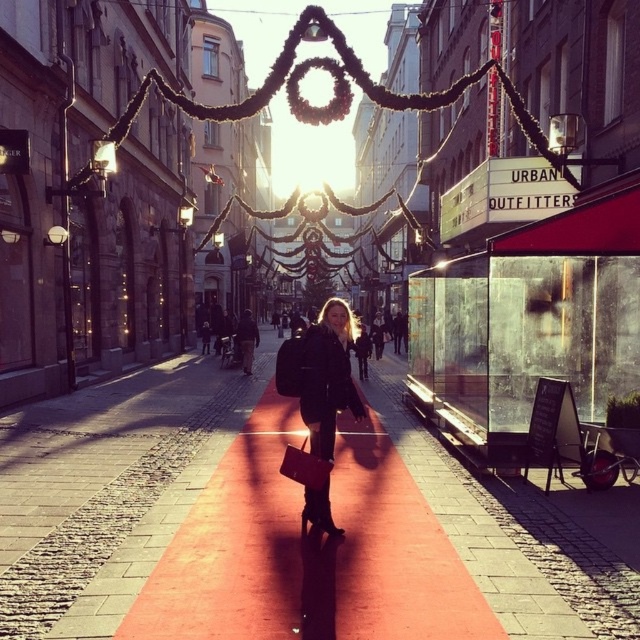
Question: Is smooth red carpet at center thinner than leather jacket at center?

Choices:
 (A) no
 (B) yes

Answer: (B)

Question: Which of the following is the farthest from the observer?

Choices:
 (A) smooth red carpet at center
 (B) matte black coat at center
 (C) leather jacket at center

Answer: (C)

Question: Which point appears farthest from the camera in this image?

Choices:
 (A) (248, 362)
 (B) (324, 394)

Answer: (A)

Question: Can you confirm if smooth red carpet at center is positioned below matte black coat at center?

Choices:
 (A) no
 (B) yes

Answer: (B)

Question: Does smooth red carpet at center appear over matte black coat at center?

Choices:
 (A) yes
 (B) no

Answer: (B)

Question: Which of the following is the closest to the observer?

Choices:
 (A) (250, 333)
 (B) (304, 600)

Answer: (B)